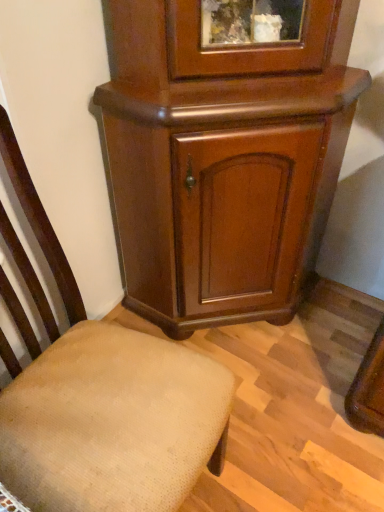
Question: Would you say shiny brown cabinet at center is a long distance from beige fabric chair at lower left?

Choices:
 (A) yes
 (B) no

Answer: (B)

Question: From the image's perspective, is shiny brown cabinet at center under beige fabric chair at lower left?

Choices:
 (A) no
 (B) yes

Answer: (A)

Question: Is beige fabric chair at lower left inside shiny brown cabinet at center?

Choices:
 (A) yes
 (B) no

Answer: (B)

Question: Can you confirm if shiny brown cabinet at center is smaller than beige fabric chair at lower left?

Choices:
 (A) no
 (B) yes

Answer: (A)

Question: Can you confirm if shiny brown cabinet at center is shorter than beige fabric chair at lower left?

Choices:
 (A) yes
 (B) no

Answer: (B)

Question: Does shiny brown cabinet at center have a larger size compared to beige fabric chair at lower left?

Choices:
 (A) yes
 (B) no

Answer: (A)

Question: Is beige fabric chair at lower left positioned with its back to shiny brown cabinet at center?

Choices:
 (A) yes
 (B) no

Answer: (B)

Question: Is beige fabric chair at lower left aimed at shiny brown cabinet at center?

Choices:
 (A) yes
 (B) no

Answer: (B)

Question: Does beige fabric chair at lower left have a lesser height compared to shiny brown cabinet at center?

Choices:
 (A) yes
 (B) no

Answer: (A)

Question: Considering the relative positions of beige fabric chair at lower left and shiny brown cabinet at center in the image provided, is beige fabric chair at lower left to the right of shiny brown cabinet at center from the viewer's perspective?

Choices:
 (A) no
 (B) yes

Answer: (A)

Question: Considering the relative sizes of beige fabric chair at lower left and shiny brown cabinet at center in the image provided, is beige fabric chair at lower left thinner than shiny brown cabinet at center?

Choices:
 (A) yes
 (B) no

Answer: (B)

Question: Considering the relative sizes of beige fabric chair at lower left and shiny brown cabinet at center in the image provided, is beige fabric chair at lower left taller than shiny brown cabinet at center?

Choices:
 (A) yes
 (B) no

Answer: (B)

Question: Considering the positions of beige fabric chair at lower left and shiny brown cabinet at center in the image, is beige fabric chair at lower left wider or thinner than shiny brown cabinet at center?

Choices:
 (A) thin
 (B) wide

Answer: (B)